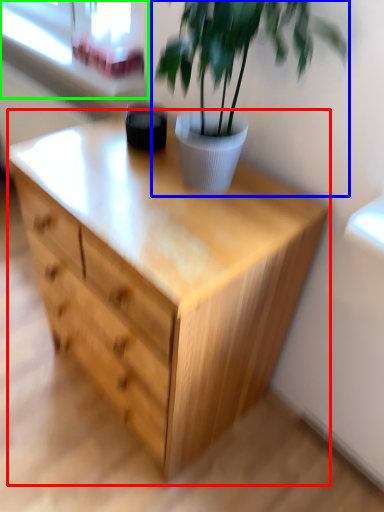
Question: Which is farther away from chest of drawers (highlighted by a red box)? houseplant (highlighted by a blue box) or window frame (highlighted by a green box)?

Choices:
 (A) houseplant
 (B) window frame

Answer: (B)